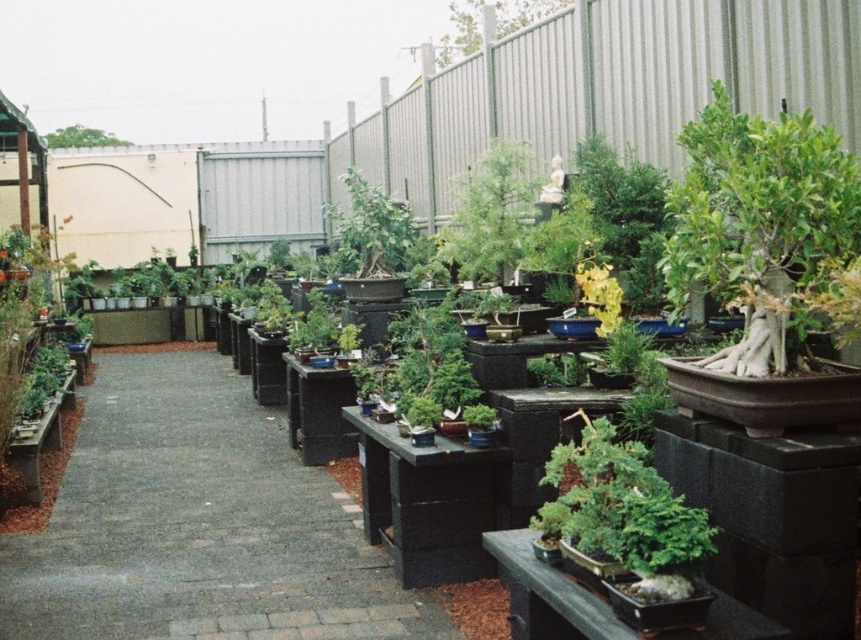
Question: Does green matte tree at upper center have a lesser width compared to green leafy tree at upper left?

Choices:
 (A) no
 (B) yes

Answer: (A)

Question: Does green matte bonsai at right appear on the left side of green leafy tree at upper left?

Choices:
 (A) yes
 (B) no

Answer: (B)

Question: Which of the following is the closest to the observer?

Choices:
 (A) [x=707, y=161]
 (B) [x=651, y=570]

Answer: (B)

Question: Does green matte bonsai at right have a greater width compared to green matte tree at upper center?

Choices:
 (A) yes
 (B) no

Answer: (B)

Question: Considering the real-world distances, which object is closest to the green matte bonsai tree at center?

Choices:
 (A) gray concrete path at center
 (B) green matte bonsai at right

Answer: (B)

Question: Which point is farther to the camera?

Choices:
 (A) gray concrete path at center
 (B) green leafy tree at upper left
 (C) green matte bonsai tree at center
 (D) green matte tree at upper center

Answer: (B)